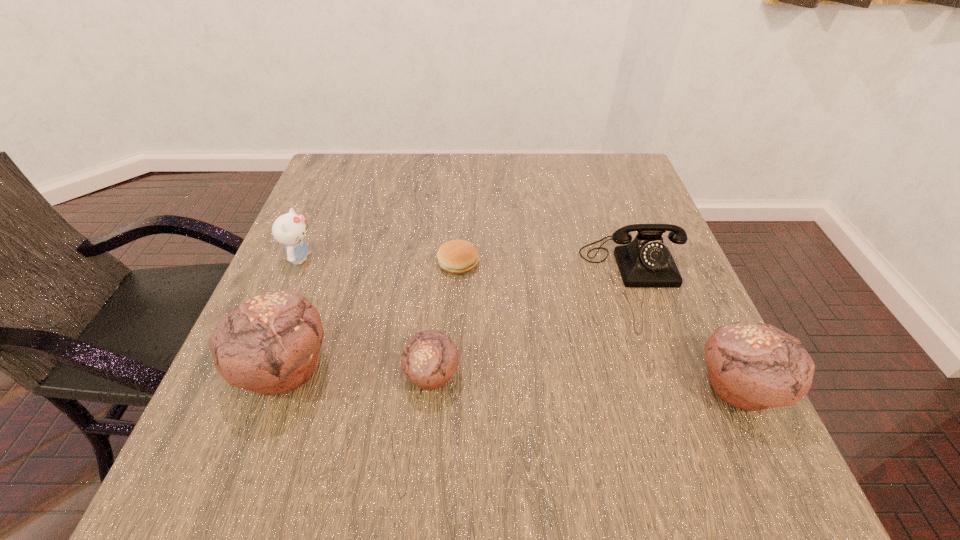
The image size is (960, 540). What are the coordinates of `the leftmost muffin` in the screenshot? It's located at (270, 344).

Find the location of a particular element. Image resolution: width=960 pixels, height=540 pixels. the second muffin from right to left is located at coordinates (430, 358).

Locate an element on the screen. The height and width of the screenshot is (540, 960). the second shortest muffin is located at coordinates (751, 366).

This screenshot has width=960, height=540. In order to click on patty in this screenshot , I will do `click(457, 257)`.

Locate an element on the screen. This screenshot has width=960, height=540. telephone is located at coordinates (646, 262).

Where is `kitten`? Image resolution: width=960 pixels, height=540 pixels. kitten is located at coordinates (289, 229).

Identify the location of vacant space located 0.240m on the right of the leftmost muffin. Image resolution: width=960 pixels, height=540 pixels. (466, 368).

Locate an element on the screen. The image size is (960, 540). vacant space located 0.340m on the right of the second muffin from right to left is located at coordinates (651, 375).

Image resolution: width=960 pixels, height=540 pixels. What are the coordinates of `vacant space situated on the left of the second tallest muffin` in the screenshot? It's located at (585, 388).

Find the location of `vacant space located on the left of the shortest object`. vacant space located on the left of the shortest object is located at coordinates (393, 263).